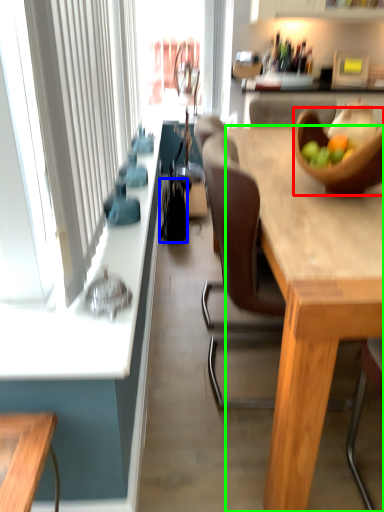
Question: Which object is the farthest from bowl (highlighted by a red box)? Choose among these: handbag (highlighted by a blue box) or desk (highlighted by a green box).

Choices:
 (A) handbag
 (B) desk

Answer: (A)